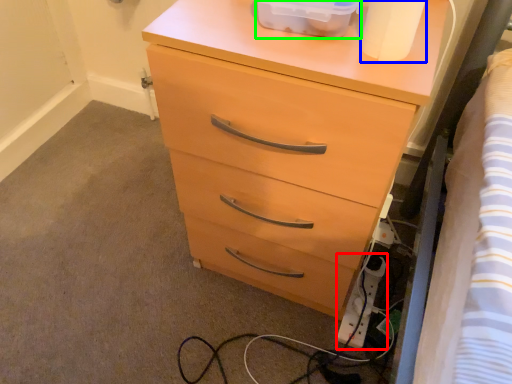
Question: Estimate the real-world distances between objects in this image. Which object is closer to extension cord (highlighted by a red box), toilet paper (highlighted by a blue box) or storage box (highlighted by a green box)?

Choices:
 (A) toilet paper
 (B) storage box

Answer: (A)